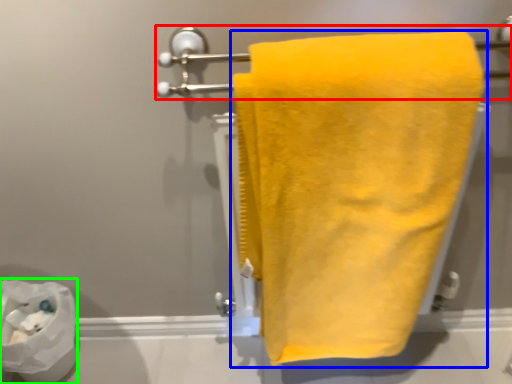
Question: Which is nearer to the towel bar (highlighted by a red box)? towel (highlighted by a blue box) or toilet paper (highlighted by a green box).

Choices:
 (A) towel
 (B) toilet paper

Answer: (A)